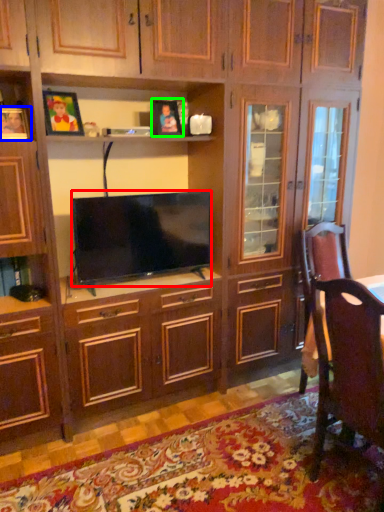
Question: Considering the real-world distances, which object is farthest from television (highlighted by a red box)? picture frame (highlighted by a blue box) or picture frame (highlighted by a green box)?

Choices:
 (A) picture frame
 (B) picture frame

Answer: (A)